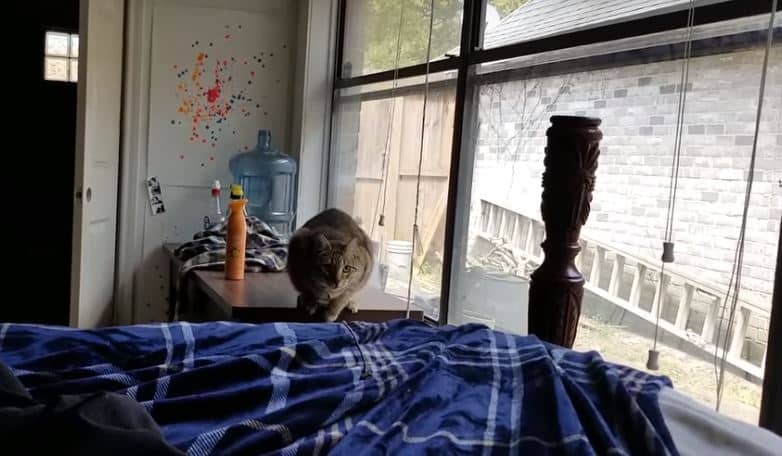
Locate an element on the screen. blankets is located at coordinates (436, 391), (213, 245), (700, 429).